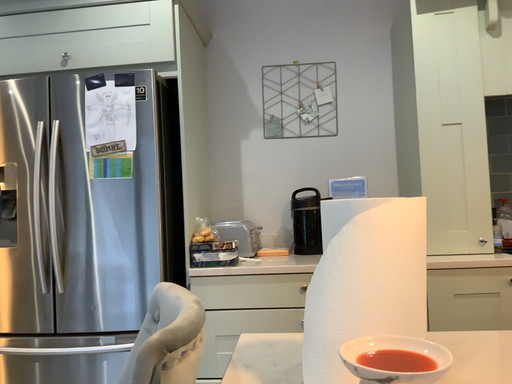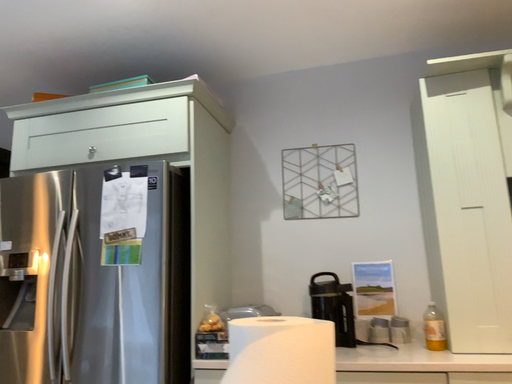
Question: How did the camera likely rotate when shooting the video?

Choices:
 (A) rotated downward
 (B) rotated upward

Answer: (B)